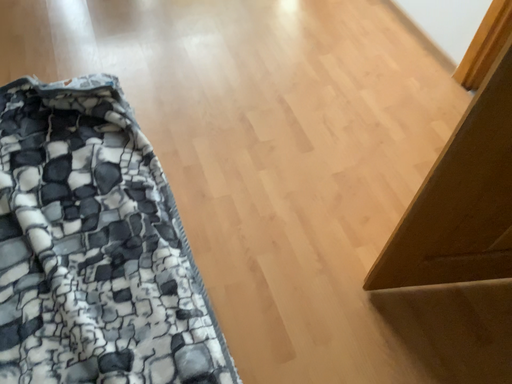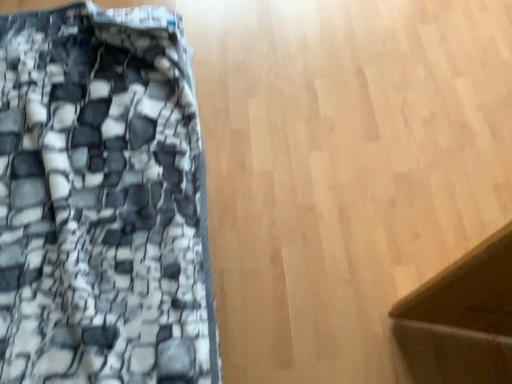
Question: Which way did the camera rotate in the video?

Choices:
 (A) rotated left
 (B) rotated right

Answer: (A)